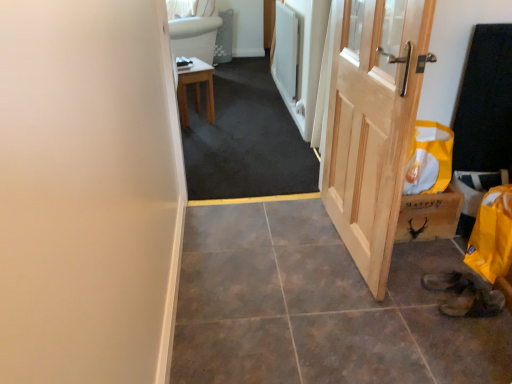
This screenshot has width=512, height=384. What are the coordinates of `vacant space underneath brown leather shoe at lower right (from a real-world perspective)` in the screenshot? It's located at [x=470, y=305].